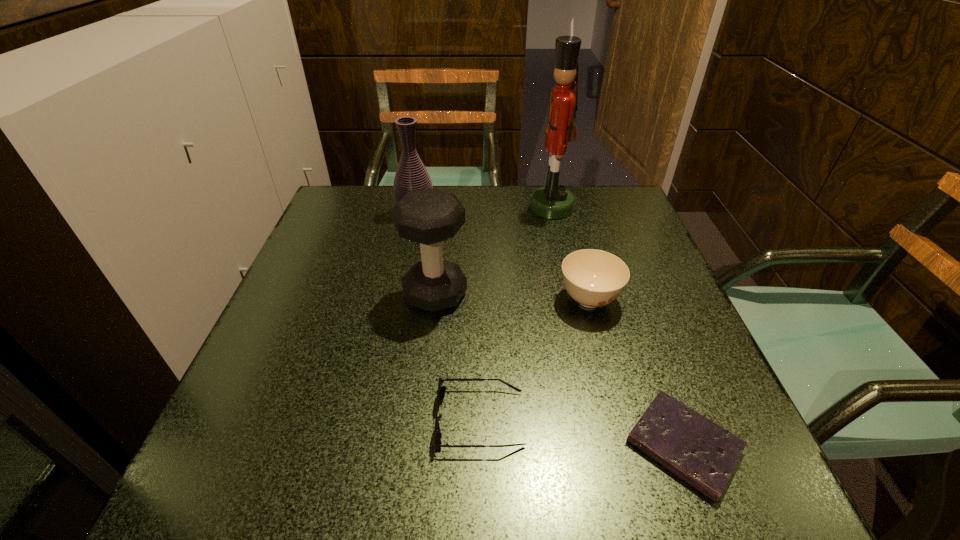
Find the location of `free space located on the left of the dumbbell`. free space located on the left of the dumbbell is located at coordinates (300, 294).

Where is `vacant position located 0.290m on the front of the sugar bowl`? The image size is (960, 540). vacant position located 0.290m on the front of the sugar bowl is located at coordinates (634, 466).

Find the location of a particular element. vacant area situated 0.180m on the front-facing side of the second shortest object is located at coordinates (325, 418).

At what (x,y) coordinates should I click in order to perform the action: click on free space located 0.320m on the front-facing side of the second shortest object. Please return your answer as a coordinate pair (x, y). The height and width of the screenshot is (540, 960). Looking at the image, I should click on (239, 418).

You are a GUI agent. You are given a task and a screenshot of the screen. Output one action in this format:
    pyautogui.click(x=<x>, y=<y>)
    Task: Click on the vacant space situated on the front-facing side of the second shortest object
    The width and height of the screenshot is (960, 540).
    Given the screenshot: What is the action you would take?
    pyautogui.click(x=257, y=418)

Locate an element on the screen. free space located 0.180m on the back of the shortest object is located at coordinates (636, 320).

Identify the location of nutcracker situated at the far edge. (553, 201).

Where is `vase that is at the far edge`? This screenshot has height=540, width=960. vase that is at the far edge is located at coordinates click(411, 175).

This screenshot has height=540, width=960. I want to click on sunglasses that is at the near edge, so click(x=441, y=389).

This screenshot has width=960, height=540. I want to click on diary situated at the near edge, so 703,454.